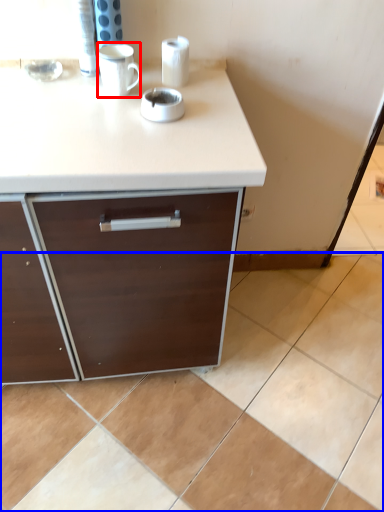
Question: Which of the following is the farthest to the observer, mug (highlighted by a red box) or ceramic tile (highlighted by a blue box)?

Choices:
 (A) mug
 (B) ceramic tile

Answer: (B)